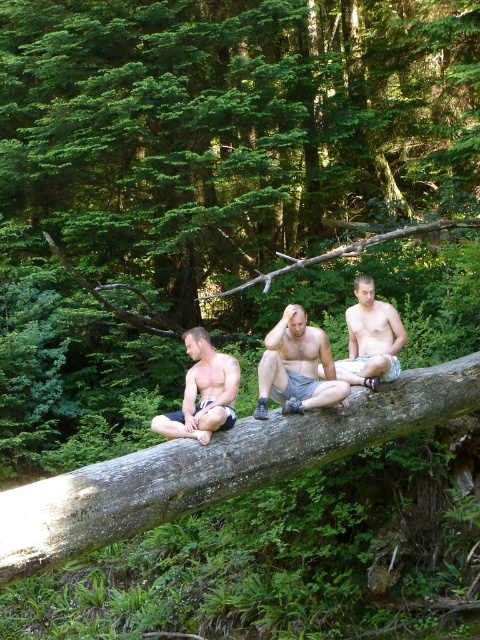
Between gray rough log at center and light brown wood log at center, which one has less height?

Standing shorter between the two is light brown wood log at center.

This screenshot has width=480, height=640. What do you see at coordinates (215, 467) in the screenshot? I see `gray rough log at center` at bounding box center [215, 467].

You are a GUI agent. You are given a task and a screenshot of the screen. Output one action in this format:
    pyautogui.click(x=<x>, y=<y>)
    Task: Click on the gray rough log at center
    This screenshot has width=480, height=640.
    Given the screenshot: What is the action you would take?
    pos(215,467)

Is point (250, 205) positioned after point (359, 324)?

Yes, point (250, 205) is farther from viewer.

Between smooth bark log at center and light brown wood log at center, which one has more height?

With more height is light brown wood log at center.

Locate an element on the screen. The width and height of the screenshot is (480, 640). smooth bark log at center is located at coordinates (230, 134).

From the picture: Can you confirm if smooth bark log at center is positioned above gray fabric shorts at center?

Yes, smooth bark log at center is above gray fabric shorts at center.

Looking at this image, does smooth bark log at center come in front of gray fabric shorts at center?

No, smooth bark log at center is further to the viewer.

Is point (203, 42) more distant than point (300, 404)?

Yes, point (203, 42) is farther from viewer.

I want to click on smooth bark log at center, so click(230, 134).